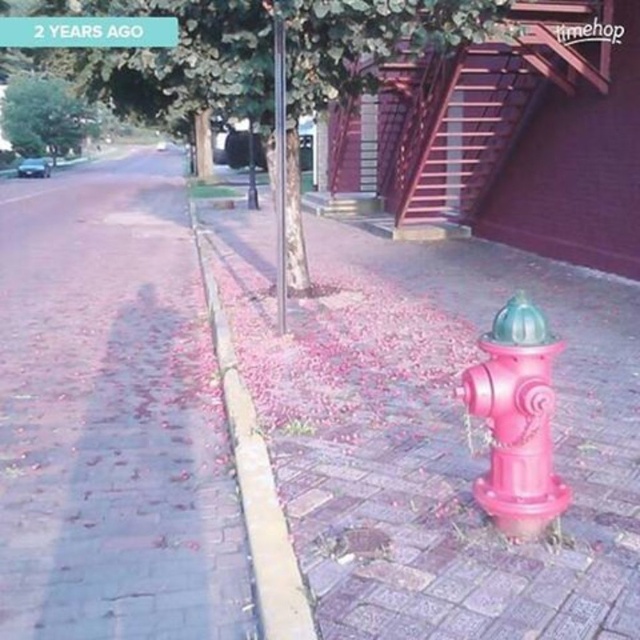
You are a delivery person trying to park your bike near the pink matte hydrant at lower right. The city rules state that you cannot park within 5 meters of any curb. Given that the yellow concrete curb at lower center is right next to the hydrant, can you park your bike here?

The pink matte hydrant at lower right is located below the yellow concrete curb at lower center, meaning the curb is very close to the hydrant. Since the city rules prohibit parking within 5 meters of any curb, you cannot park your bike near the pink matte hydrant at lower right here.

You are standing at the center of the image and want to walk to the pink matte fire hydrant at lower right. According to the coordinates provided, in which direction should you move first?

The pink matte fire hydrant at lower right is located at point (433,435), which means you should move to the right and downward from the center to reach it.